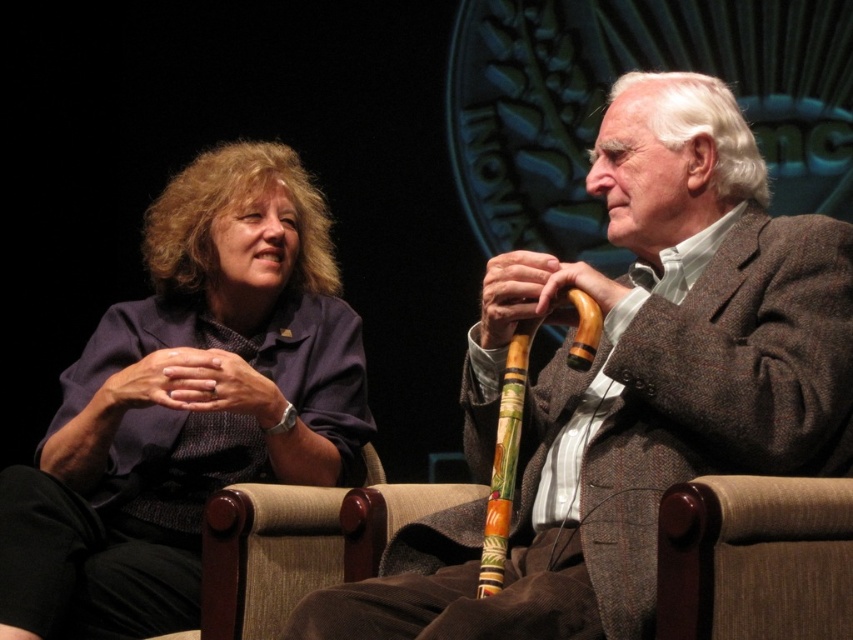
Is brown textured cane at center below carved wooden cane at center?

Incorrect, brown textured cane at center is not positioned below carved wooden cane at center.

Between brown textured cane at center and carved wooden cane at center, which one appears on the right side from the viewer's perspective?

brown textured cane at center is more to the right.

Does point (415, 566) lie behind point (490, 538)?

Yes, it is.

You are a GUI agent. You are given a task and a screenshot of the screen. Output one action in this format:
    pyautogui.click(x=<x>, y=<y>)
    Task: Click on the brown textured cane at center
    
    Given the screenshot: What is the action you would take?
    pyautogui.click(x=631, y=385)

Is matte purple jacket at left shorter than carved wooden cane at center?

Incorrect, matte purple jacket at left's height does not fall short of carved wooden cane at center's.

Who is more distant from viewer, (177, 220) or (503, 374)?

Point (177, 220)

Image resolution: width=853 pixels, height=640 pixels. Find the location of `matte purple jacket at left`. matte purple jacket at left is located at coordinates [186, 404].

How distant is brown textured cane at center from matte purple jacket at left?

brown textured cane at center and matte purple jacket at left are 1.15 meters apart.

Between brown textured cane at center and matte purple jacket at left, which one is positioned lower?

Positioned lower is brown textured cane at center.

Where is `brown textured cane at center`? The height and width of the screenshot is (640, 853). brown textured cane at center is located at coordinates (631, 385).